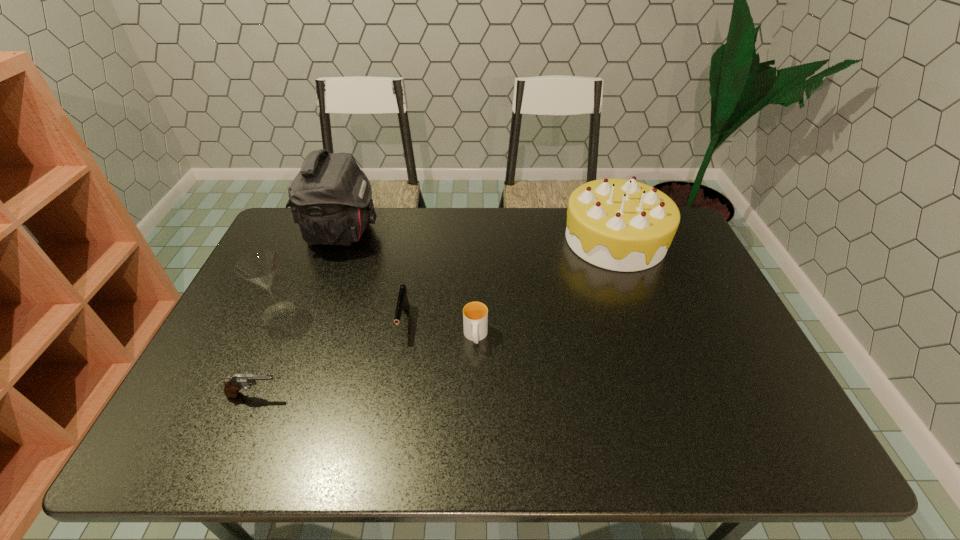
Where is `the tallest object`? This screenshot has width=960, height=540. the tallest object is located at coordinates (330, 198).

Where is `the rightmost object`? This screenshot has width=960, height=540. the rightmost object is located at coordinates (622, 225).

This screenshot has height=540, width=960. I want to click on flute glass, so click(x=260, y=267).

This screenshot has height=540, width=960. What are the coordinates of `the right pistol` in the screenshot? It's located at (402, 303).

Where is `the farther pistol`? Image resolution: width=960 pixels, height=540 pixels. the farther pistol is located at coordinates (402, 303).

Locate an element on the screen. This screenshot has height=540, width=960. the nearer pistol is located at coordinates (233, 384).

You are a GUI agent. You are given a task and a screenshot of the screen. Output one action in this format:
    pyautogui.click(x=<x>, y=<y>)
    Task: Click on the left pistol
    
    Given the screenshot: What is the action you would take?
    [x=233, y=384]

Where is `the fifth object from left to right`? Image resolution: width=960 pixels, height=540 pixels. the fifth object from left to right is located at coordinates (475, 314).

What are the coordinates of `vacant space located on the open flap of the tallest object` in the screenshot? It's located at (416, 232).

At what (x,y) coordinates should I click in order to perform the action: click on free space located 0.050m on the front of the rightmost object. Please return your answer as a coordinate pair (x, y). Looking at the image, I should click on (632, 285).